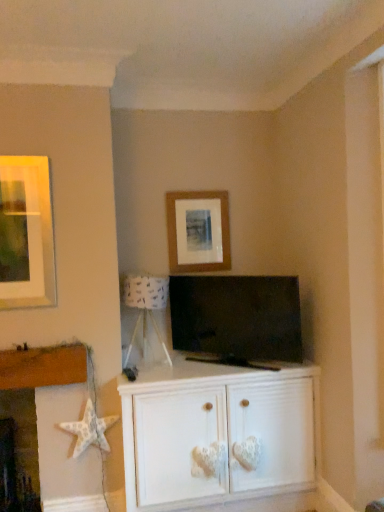
Question: Choose the correct answer: Is wooden picture frame at center inside white painted wood cabinet at center or outside it?

Choices:
 (A) outside
 (B) inside

Answer: (A)

Question: Considering the relative positions of wooden picture frame at center and white painted wood cabinet at center in the image provided, is wooden picture frame at center to the left or to the right of white painted wood cabinet at center?

Choices:
 (A) left
 (B) right

Answer: (A)

Question: Estimate the real-world distances between objects in this image. Which object is farther from the matte black tv at center?

Choices:
 (A) white painted wood cabinet at center
 (B) white paper lampshade at center
 (C) white textured star at lower left
 (D) wooden picture frame at center
 (E) white fabric starfish at lower left

Answer: (C)

Question: Based on their relative distances, which object is farther from the white textured star at lower left?

Choices:
 (A) white paper lampshade at center
 (B) matte black tv at center
 (C) wooden picture frame at center
 (D) white fabric starfish at lower left
 (E) white painted wood cabinet at center

Answer: (C)